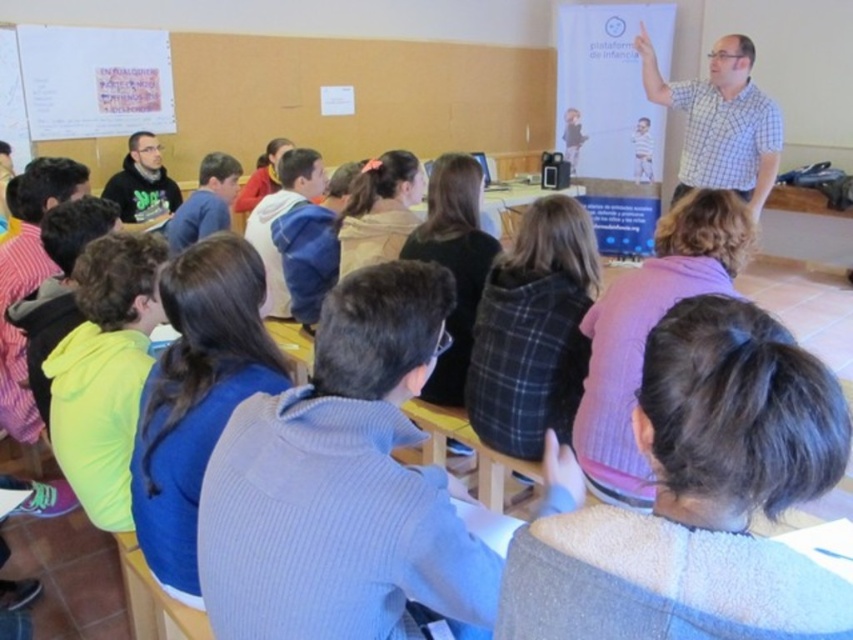
Question: Estimate the real-world distances between objects in this image. Which object is closer to the black hoodie at lower left?

Choices:
 (A) checkered fabric shirt at upper right
 (B) matte black hoodie at center

Answer: (B)

Question: Which of the following is the farthest from the observer?

Choices:
 (A) matte black hoodie at center
 (B) checkered fabric shirt at upper right
 (C) black hoodie at lower left
 (D) blue fleece jacket at center

Answer: (C)

Question: Which of the following is the closest to the observer?

Choices:
 (A) checkered fabric shirt at upper right
 (B) black hoodie at lower left
 (C) blue fleece jacket at center
 (D) matte black hoodie at center

Answer: (C)

Question: Does checkered fabric shirt at upper right appear over matte black hoodie at center?

Choices:
 (A) yes
 (B) no

Answer: (A)

Question: Is checkered fabric shirt at upper right below black hoodie at lower left?

Choices:
 (A) yes
 (B) no

Answer: (B)

Question: Does blue fleece jacket at center lie in front of black hoodie at lower left?

Choices:
 (A) yes
 (B) no

Answer: (A)